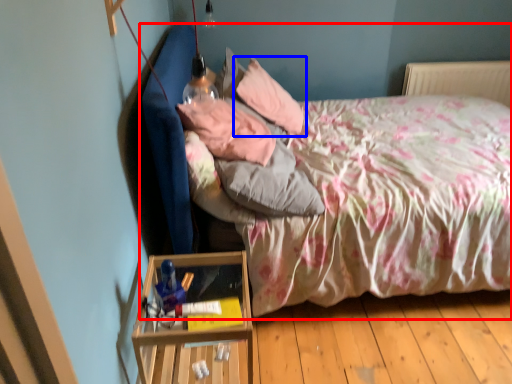
Question: Among these objects, which one is farthest to the camera, bed (highlighted by a red box) or pillow (highlighted by a blue box)?

Choices:
 (A) bed
 (B) pillow

Answer: (B)